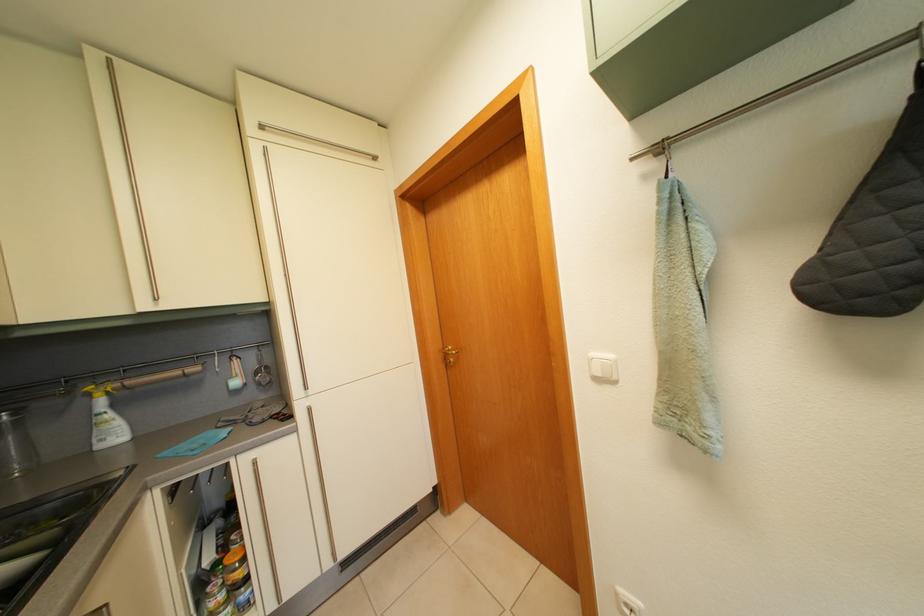
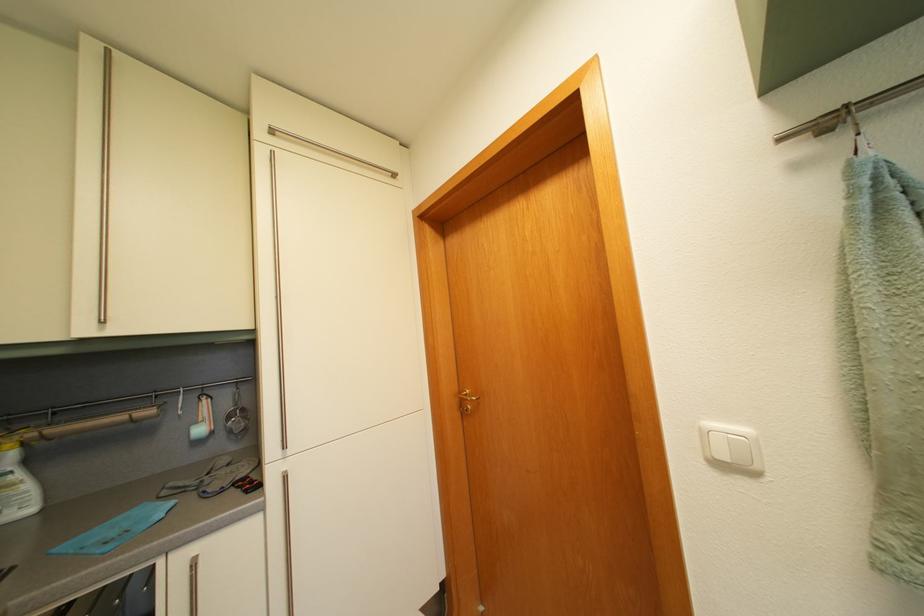
The point at (619, 363) is marked in the first image. Where is the corresponding point in the second image?

(755, 438)